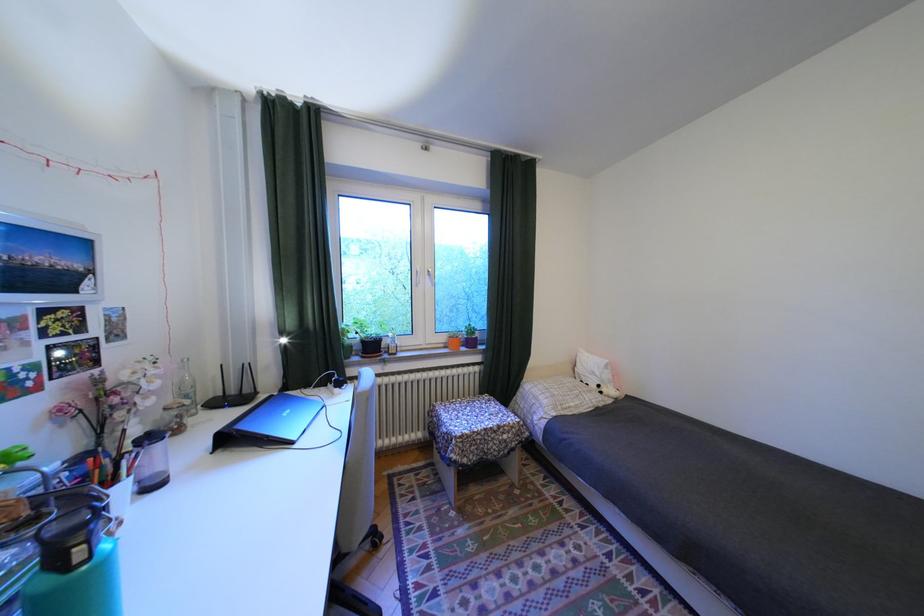
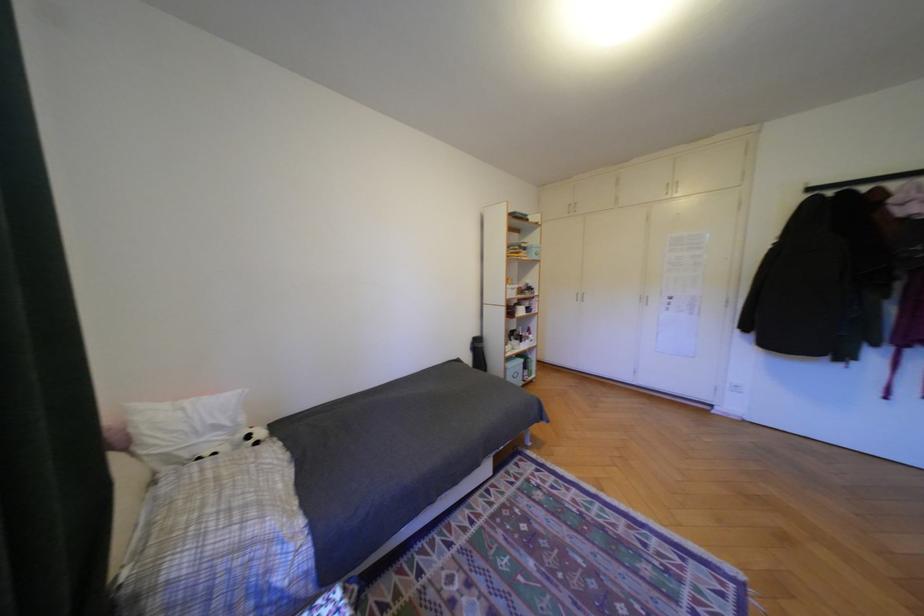
The point at (611, 386) is marked in the first image. Where is the corresponding point in the second image?

(261, 437)